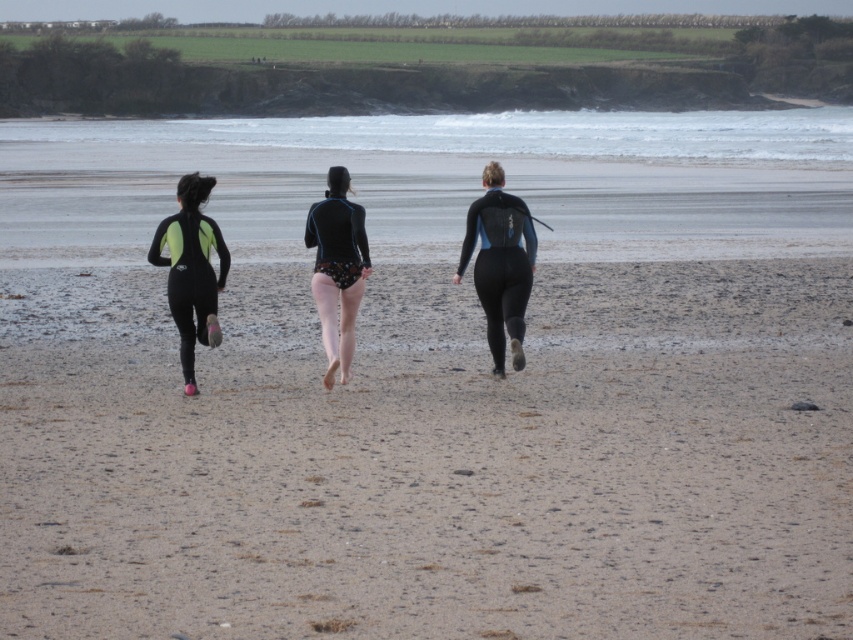
You are a photographer positioned at the origin point of the image. You want to capture a closeup shot of the black matte wetsuit at center. Which direction should you move your camera to focus on it?

You should move your camera to the right and upward since the black matte wetsuit at center is located at coordinates point (500, 264).

You are a photographer positioned on the beach, aiming to capture a photo of the neon green neoprene wetsuit at left and the black matte swimsuit at center. Your camera has a maximum focus range of 30 inches. Can you capture both subjects in focus without moving your position?

The distance between the neon green neoprene wetsuit at left and the black matte swimsuit at center is 29.60 inches, which is within the camera maximum focus range of 30 inches. Therefore, you can capture both subjects in focus without moving your position.